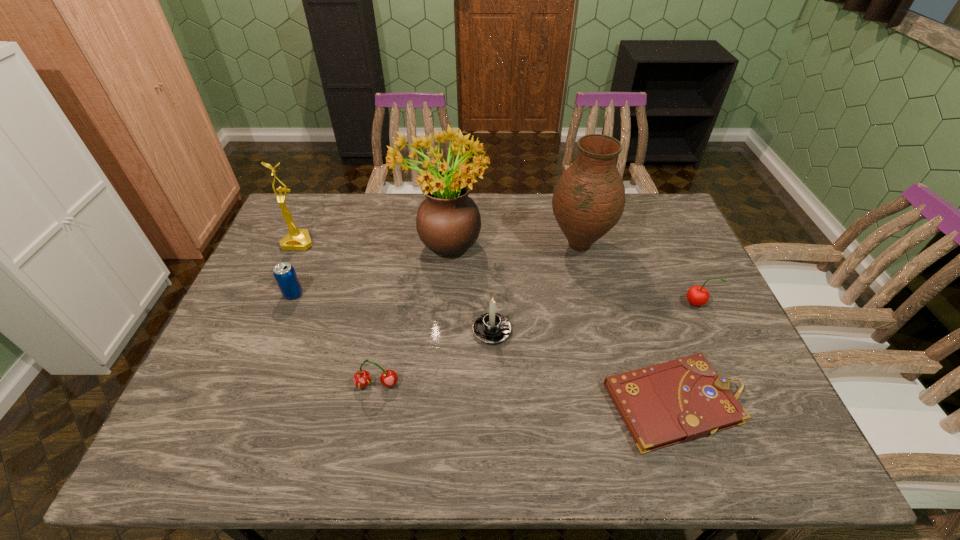
This screenshot has width=960, height=540. Identify the location of the second closest object to the left cherry. (284, 273).

The image size is (960, 540). I want to click on vacant space that satisfies the following two spatial constraints: 1. on the front-facing side of the vase; 2. on the right side of the third tallest object, so click(x=298, y=245).

Locate an element on the screen. The image size is (960, 540). vacant space that satisfies the following two spatial constraints: 1. on the front-facing side of the sixth shortest object; 2. on the right side of the right cherry is located at coordinates (271, 303).

Where is `free space that satisfies the following two spatial constraints: 1. on the front-facing side of the sixth shortest object; 2. on the left side of the right cherry`? free space that satisfies the following two spatial constraints: 1. on the front-facing side of the sixth shortest object; 2. on the left side of the right cherry is located at coordinates (271, 303).